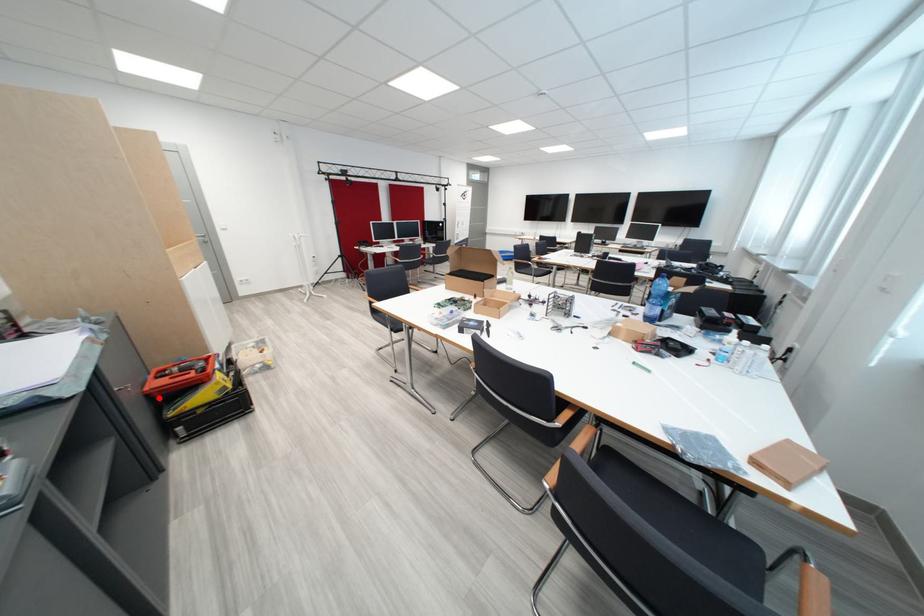
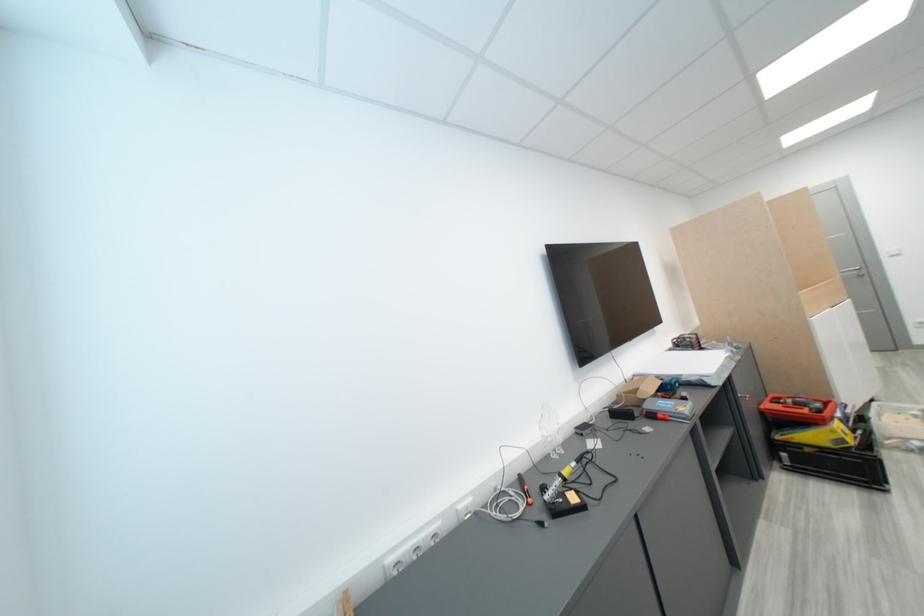
The point at the highlighted location is marked in the first image. Where is the corresponding point in the second image?

(772, 416)